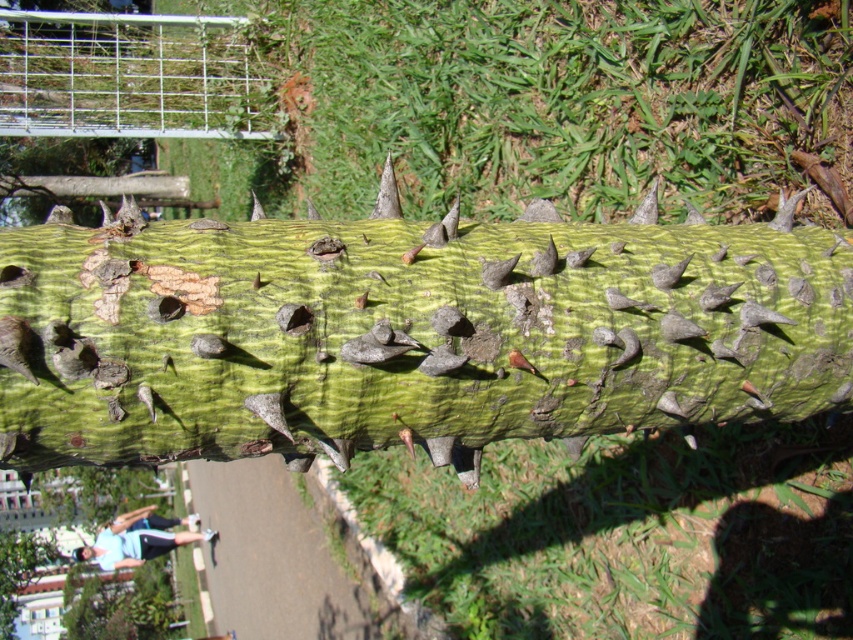
Question: Which object appears farthest from the camera in this image?

Choices:
 (A) blue fabric at lower left
 (B) green rough bark at center

Answer: (A)

Question: Is green rough bark at center bigger than blue fabric at lower left?

Choices:
 (A) no
 (B) yes

Answer: (A)

Question: Which point is closer to the camera taking this photo?

Choices:
 (A) (158, 550)
 (B) (619, 356)

Answer: (B)

Question: Does green rough bark at center come in front of blue fabric at lower left?

Choices:
 (A) yes
 (B) no

Answer: (A)

Question: Observing the image, what is the correct spatial positioning of green rough bark at center in reference to blue fabric at lower left?

Choices:
 (A) below
 (B) above

Answer: (B)